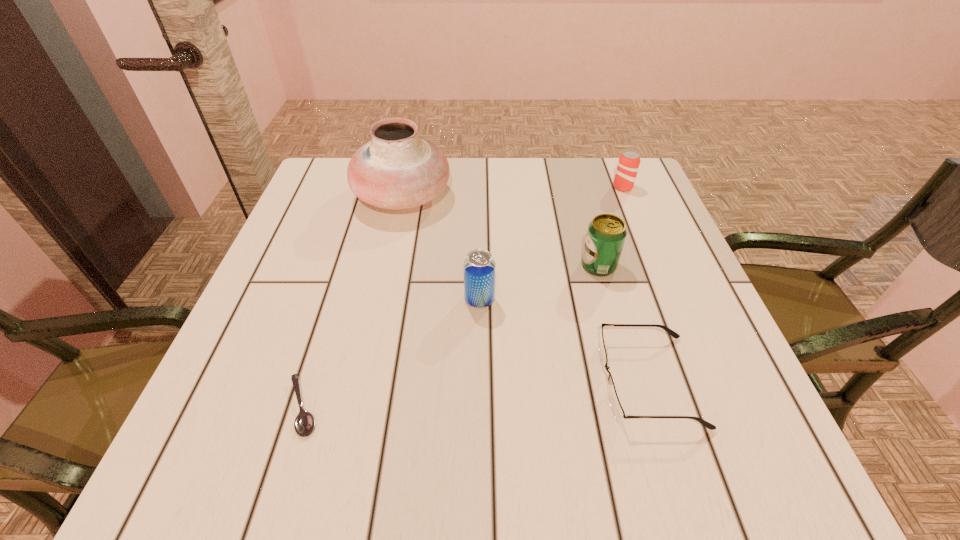
This screenshot has width=960, height=540. What are the coordinates of `free region located 0.360m on the left of the fourth nearest object` in the screenshot? It's located at (414, 266).

Image resolution: width=960 pixels, height=540 pixels. In order to click on free region located 0.090m on the front of the fourth farthest object in this screenshot , I will do `click(479, 349)`.

In order to click on free spot located 0.360m on the front of the farthest beer can in this screenshot , I will do `click(666, 295)`.

This screenshot has height=540, width=960. I want to click on free location located on the front-facing side of the second shortest object, so click(366, 381).

Locate an element on the screen. Image resolution: width=960 pixels, height=540 pixels. free location located 0.150m on the front-facing side of the second shortest object is located at coordinates (513, 381).

Identify the location of free space located on the front-facing side of the second shortest object. (548, 381).

The image size is (960, 540). I want to click on free space located on the back of the shortest object, so click(358, 230).

Find the location of a particular element. The image size is (960, 540). pottery present at the far edge is located at coordinates (397, 169).

The height and width of the screenshot is (540, 960). In order to click on beer can that is at the far edge in this screenshot , I will do `click(628, 164)`.

Locate an element on the screen. spectacles at the near edge is located at coordinates (619, 414).